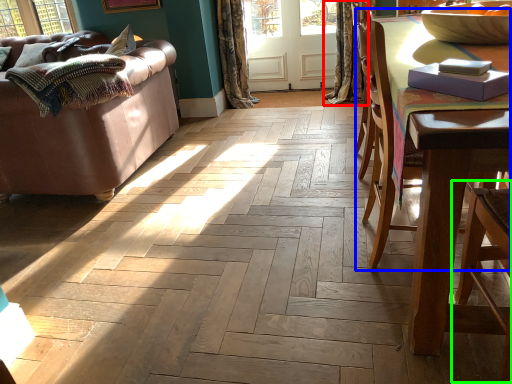
Question: Considering the real-world distances, which object is farthest from curtain (highlighted by a red box)? chair (highlighted by a blue box) or armchair (highlighted by a green box)?

Choices:
 (A) chair
 (B) armchair

Answer: (B)